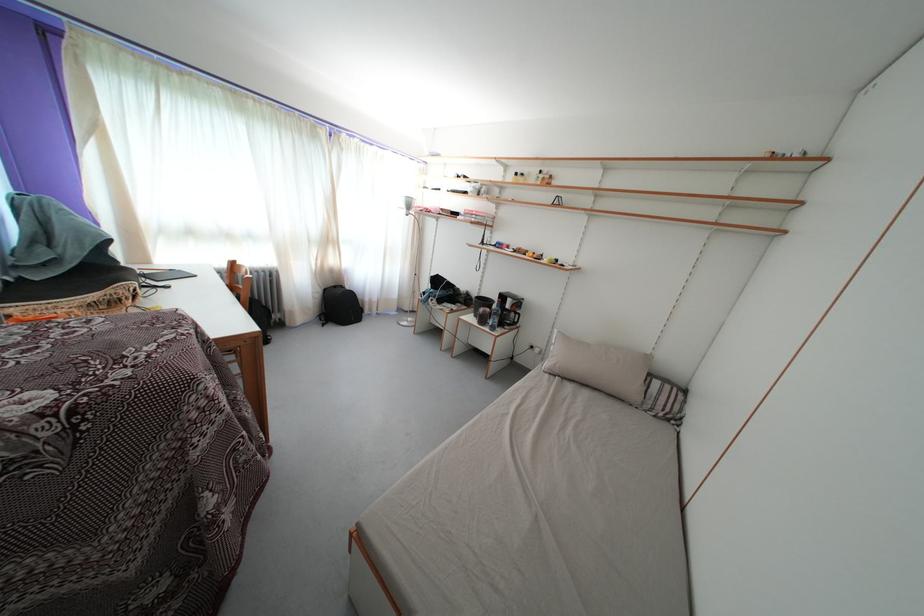
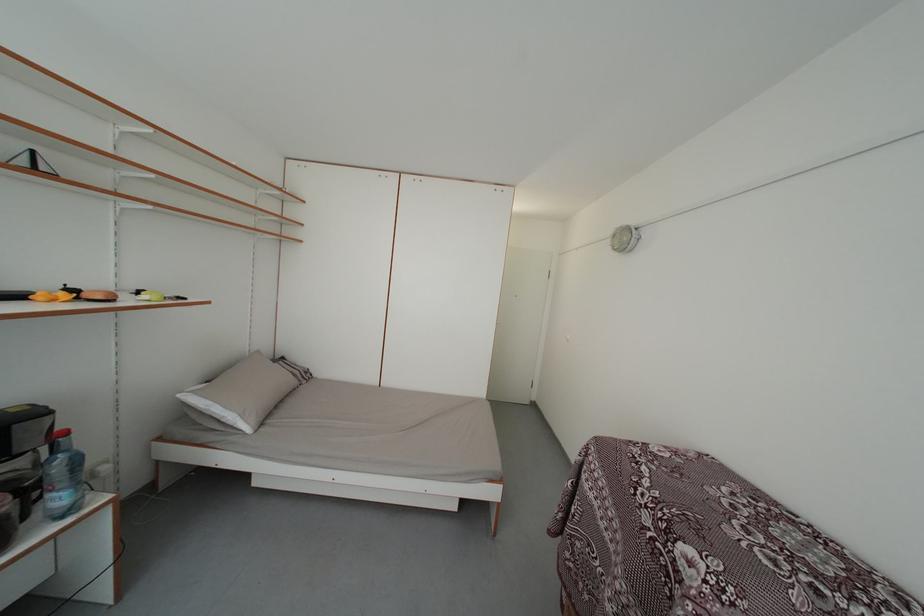
Where in the second image is the point corresponding to point (690, 397) from the first image?

(289, 365)